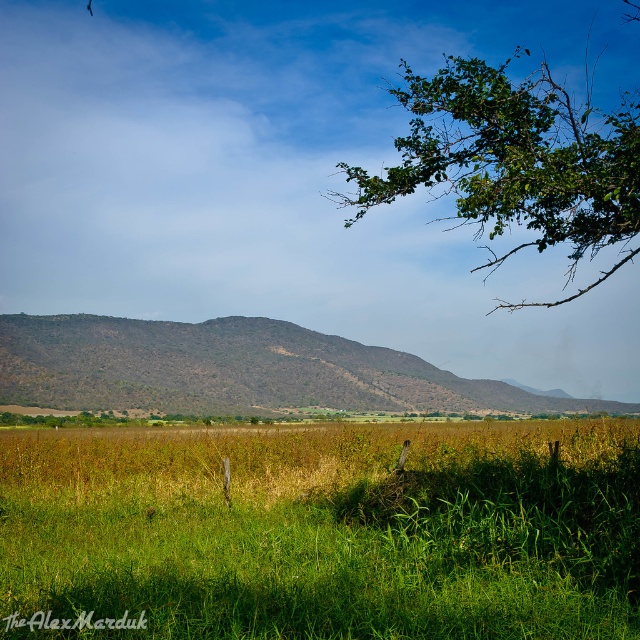
Question: Does green grassy at center appear over brown/dry grassy at center?

Choices:
 (A) yes
 (B) no

Answer: (B)

Question: Does brown/dry grassy at center appear on the left side of green leafy branch at upper right?

Choices:
 (A) yes
 (B) no

Answer: (A)

Question: Which object is closer to the camera taking this photo?

Choices:
 (A) green grassy at center
 (B) brown/dry grassy at center
 (C) green leafy branch at upper right

Answer: (A)

Question: Which point is farther to the camera?

Choices:
 (A) (353, 372)
 (B) (476, 122)
 (C) (186, 492)

Answer: (A)

Question: Is brown/dry grassy at center thinner than green leafy branch at upper right?

Choices:
 (A) no
 (B) yes

Answer: (A)

Question: Which point is farther from the camera taking this photo?

Choices:
 (A) (566, 164)
 (B) (552, 428)
 (C) (67, 342)

Answer: (C)